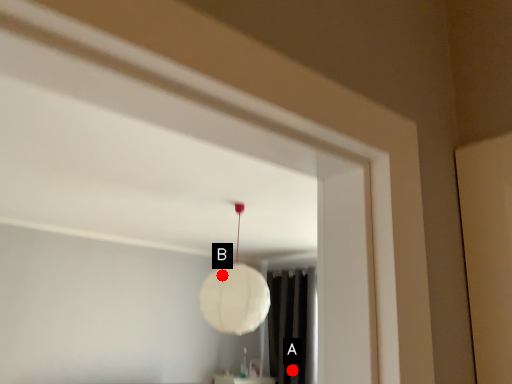
Question: Two points are circled on the image, labeled by A and B beside each circle. Which point appears closest to the camera in this image?

Choices:
 (A) A is closer
 (B) B is closer

Answer: (B)